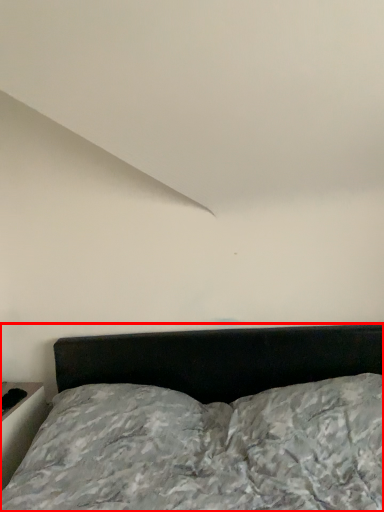
Question: From the image's perspective, where is bed (annotated by the red box) located in relation to table in the image?

Choices:
 (A) below
 (B) above

Answer: (B)